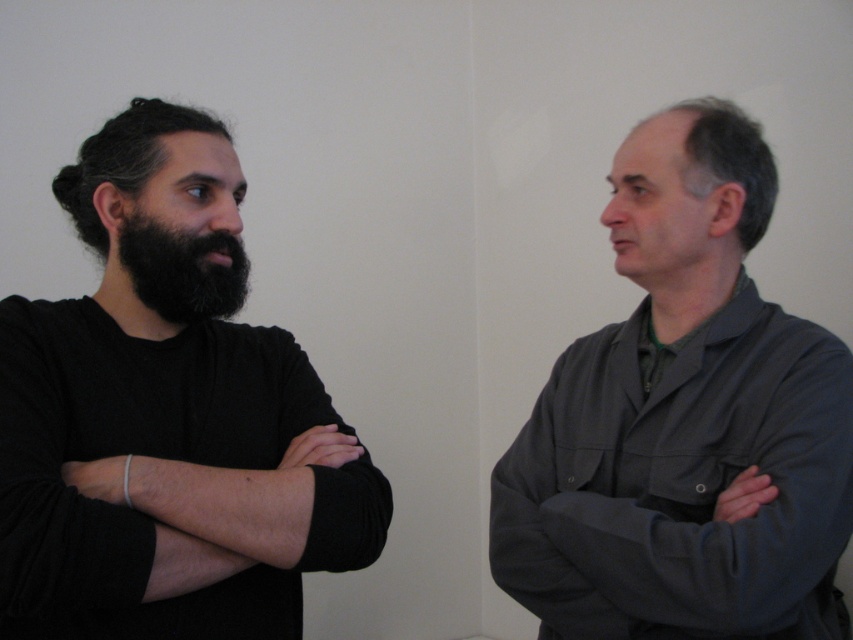
You are an interior designer planning to place a new artwork on the wall in this scene. The artwork requires a space that is not occupied by the black knitted sweater at left. Where should you place it to avoid covering the sweater?

The black knitted sweater at left is located at point (167, 417). To avoid covering it, place the artwork elsewhere on the wall, such as near the edges or opposite side of the wall where there is no object.

You are a fashion designer observing two people in an image. You notice the black knitted sweater at left and the black fuzzy beard at left. Which of these two items is taller?

The black knitted sweater at left is taller than the black fuzzy beard at left.

You are standing in the room where the two people are conversing. You need to place a small plant between the two points indicated by point (230, 246) and point (712, 336). Which point should the plant be closer to?

The plant should be placed closer to point (230, 246) because it is in front of point (712, 336).